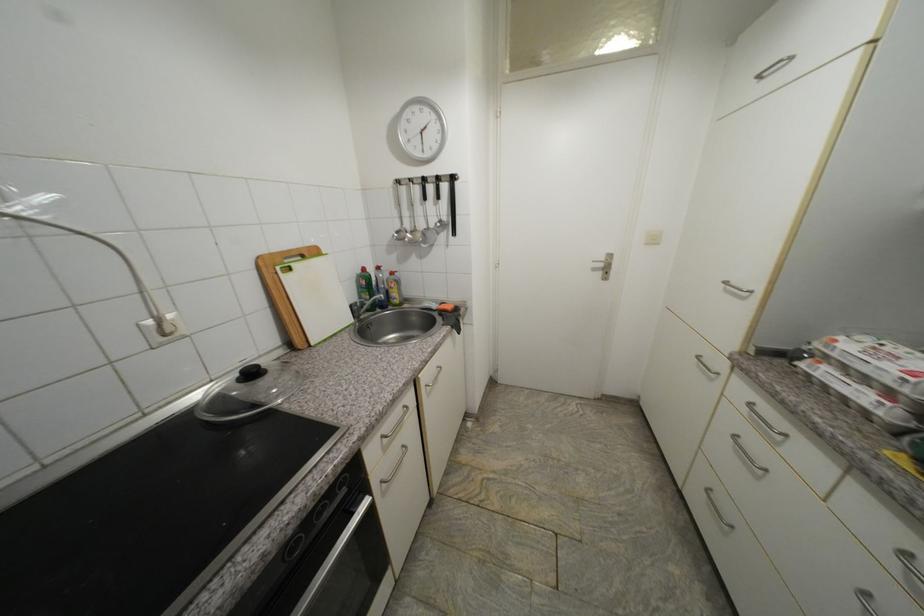
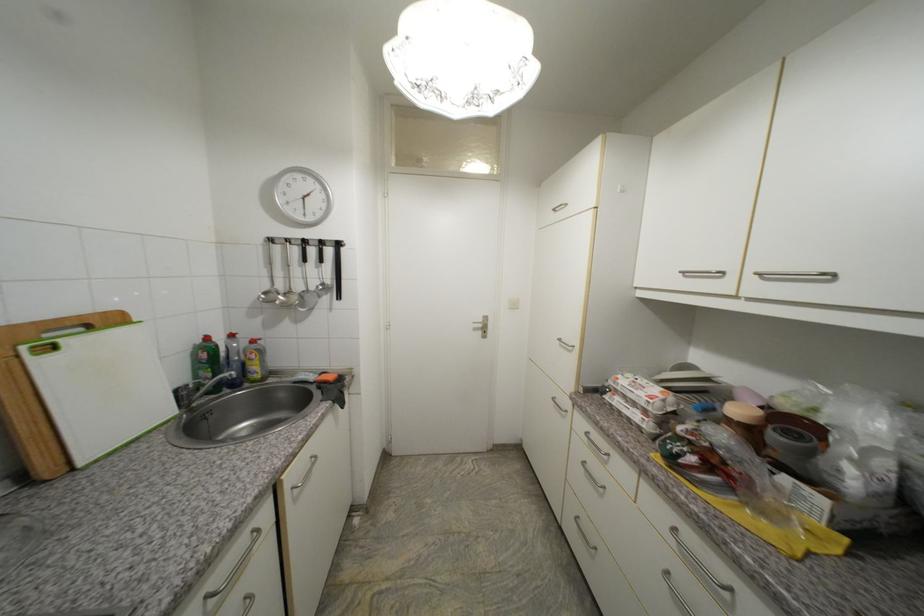
Find the pixel in the second image that matches point 732,284 in the first image.

(565, 341)